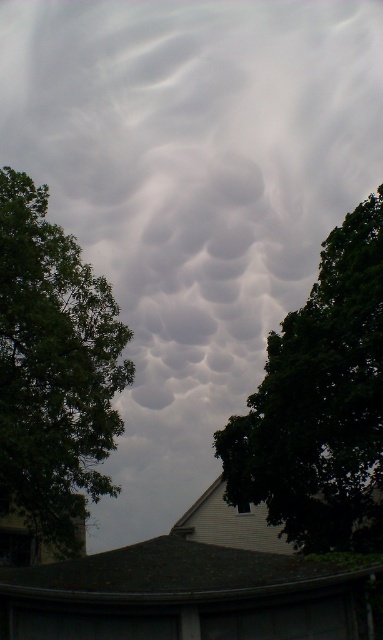
What are the coordinates of the green leafy tree at center?

The green leafy tree at center is located at coordinates point [320,403].

You are standing in front of the scene with two points marked. The first point is at coordinates point (376, 352) and the second is at point (19, 520). Which point is closer to your eyes?

Point (376, 352) is closer to the camera than point (19, 520).

You are standing in a park and want to take a photo of both the green leafy tree at center and the green leafy tree at left. If your camera can capture a maximum distance of 6 meters between objects in the frame, will you be able to include both trees in a single photo?

The green leafy tree at center is 6.55 meters away from the green leafy tree at left. Since the camera can only capture up to 6 meters between objects, the distance between them exceeds the camera range. Therefore, both trees cannot be included in a single photo.